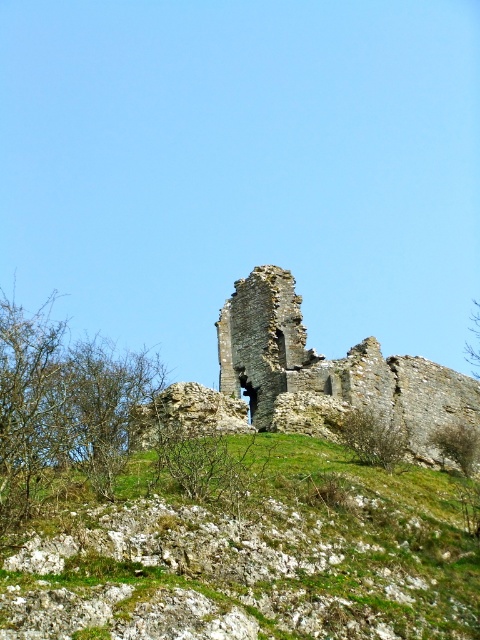
Question: Which object is farther from the camera taking this photo?

Choices:
 (A) rustic stone castle at center
 (B) green grassy at center

Answer: (A)

Question: Which point appears farthest from the camera in this image?

Choices:
 (A) (445, 387)
 (B) (180, 458)

Answer: (A)

Question: Observing the image, what is the correct spatial positioning of green grassy at center in reference to rustic stone castle at center?

Choices:
 (A) below
 (B) above

Answer: (A)

Question: Can you confirm if green grassy at center is smaller than rustic stone castle at center?

Choices:
 (A) no
 (B) yes

Answer: (B)

Question: Does green grassy at center appear over rustic stone castle at center?

Choices:
 (A) yes
 (B) no

Answer: (B)